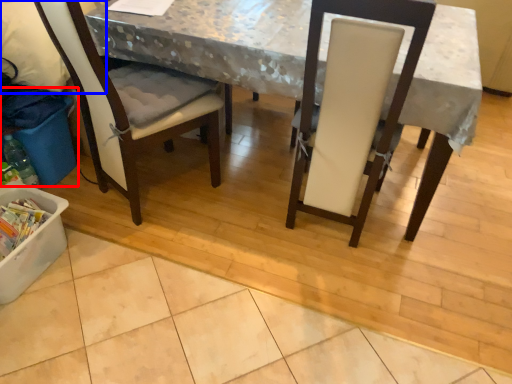
Question: Which object appears farthest to the camera in this image, recycling bin (highlighted by a red box) or leftover (highlighted by a blue box)?

Choices:
 (A) recycling bin
 (B) leftover

Answer: (A)